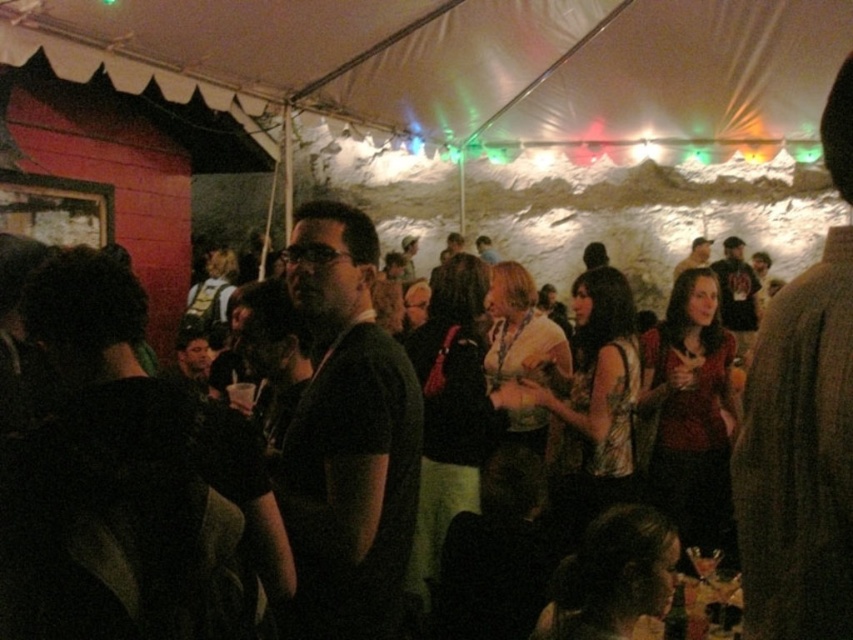
Question: Can you confirm if dark green t-shirt at center is positioned below matte black shirt at center?

Choices:
 (A) no
 (B) yes

Answer: (B)

Question: Can you confirm if dark clothing at center is positioned to the left of dark fabric shirt at left?

Choices:
 (A) no
 (B) yes

Answer: (A)

Question: Which object appears farthest from the camera in this image?

Choices:
 (A) matte black shirt at center
 (B) dark fabric shirt at left

Answer: (A)

Question: Which of the following is the farthest from the observer?

Choices:
 (A) dark gray t-shirt at center
 (B) dark brown sweater at right
 (C) matte black shirt at center
 (D) dark green t-shirt at center

Answer: (C)

Question: Is dark clothing at center positioned at the back of dark green t-shirt at center?

Choices:
 (A) yes
 (B) no

Answer: (B)

Question: Which point is closer to the camera taking this photo?

Choices:
 (A) (793, 616)
 (B) (357, 291)

Answer: (A)